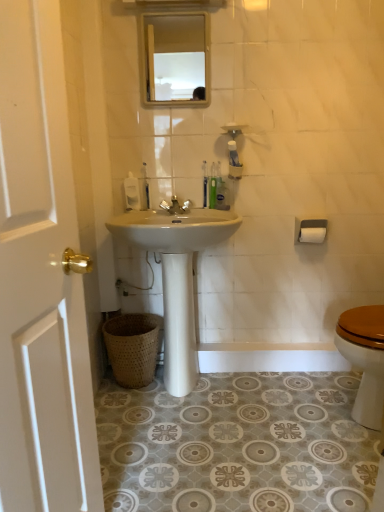
Question: Is point (16, 34) closer or farther from the camera than point (205, 229)?

Choices:
 (A) farther
 (B) closer

Answer: (B)

Question: Which is correct: white wood door at left is inside white glossy sink at center, or outside of it?

Choices:
 (A) inside
 (B) outside

Answer: (B)

Question: Which object is the closest to the white glossy sink at center?

Choices:
 (A) clear glass mirror at upper center
 (B) brown woven basket at lower left
 (C) silver metallic faucet at center
 (D) white wood door at left
 (E) translucent plastic toothbrushes at upper center, the 2th toiletries from the left

Answer: (B)

Question: Which object is positioned closest to the white wood door at left?

Choices:
 (A) translucent plastic toothbrushes at upper center, the 1th toiletries positioned from the right
 (B) translucent plastic toothbrush at center, the 2th toothbrush viewed from the left
 (C) clear glass mirror at upper center
 (D) translucent plastic soap dispenser at upper center, which is the 2th toiletries in right-to-left order
 (E) green plastic toothbrush at upper center, the third toothbrush in the left-to-right sequence

Answer: (D)